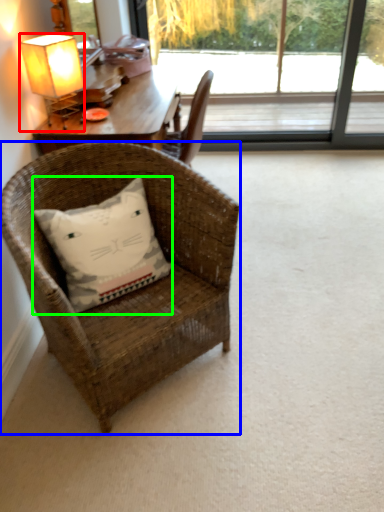
Question: Which is nearer to the lamp (highlighted by a red box)? chair (highlighted by a blue box) or pillow (highlighted by a green box).

Choices:
 (A) chair
 (B) pillow

Answer: (B)